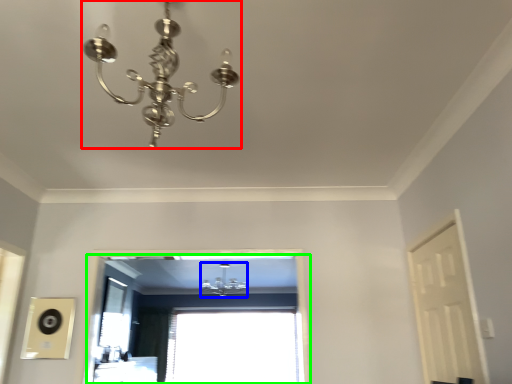
Question: Considering the real-world distances, which object is farthest from lamp (highlighted by a red box)? lamp (highlighted by a blue box) or window (highlighted by a green box)?

Choices:
 (A) lamp
 (B) window

Answer: (B)